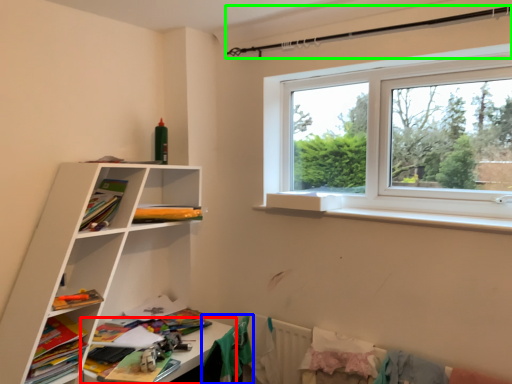
Question: Which object is the closest to the table (highlighted by a red box)? Choose among these: clothing (highlighted by a blue box) or clothesline (highlighted by a green box).

Choices:
 (A) clothing
 (B) clothesline

Answer: (A)